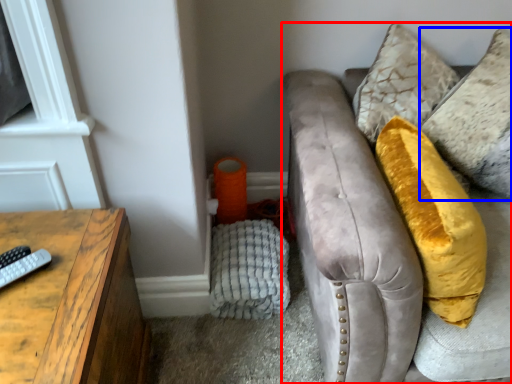
Question: Which point is further to the camera, studio couch (highlighted by a red box) or pillow (highlighted by a blue box)?

Choices:
 (A) studio couch
 (B) pillow

Answer: (B)